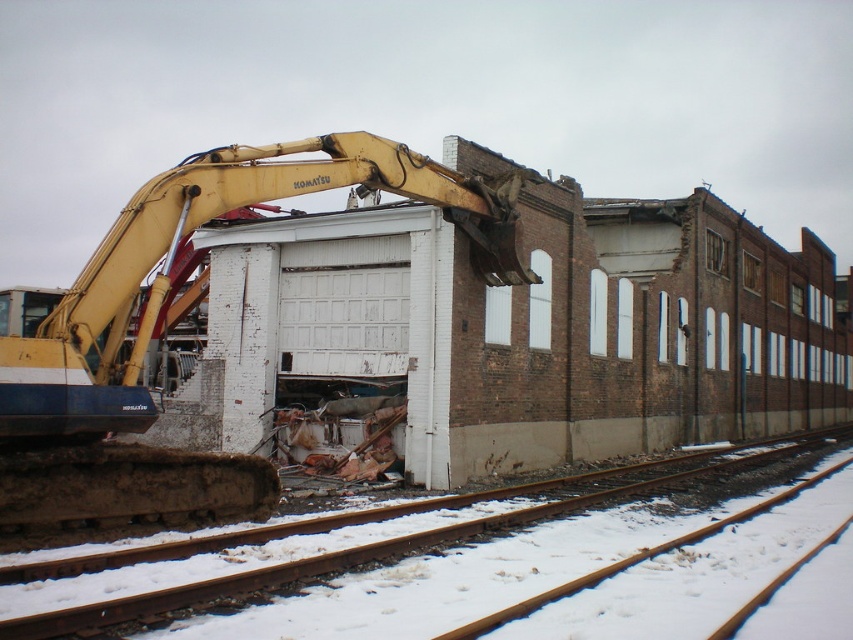
Consider the image. Is snow-covered metal tracks at lower left shorter than yellow metallic excavator at center?

Yes.

From the picture: How much distance is there between snow-covered metal tracks at lower left and yellow metallic excavator at center?

snow-covered metal tracks at lower left and yellow metallic excavator at center are 4.76 meters apart from each other.

Find the location of `snow-covered metal tracks at lower left`. snow-covered metal tracks at lower left is located at coordinates (378, 563).